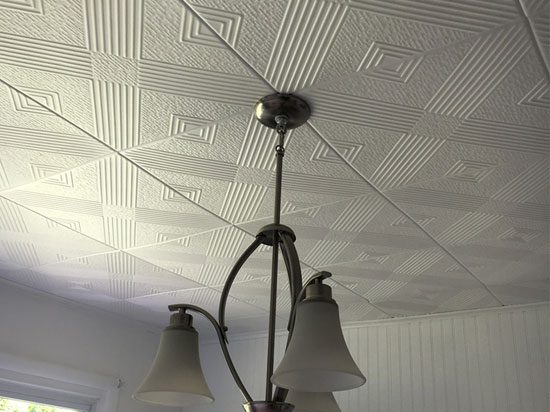
The height and width of the screenshot is (412, 550). What are the coordinates of `window` in the screenshot? It's located at (24, 407).